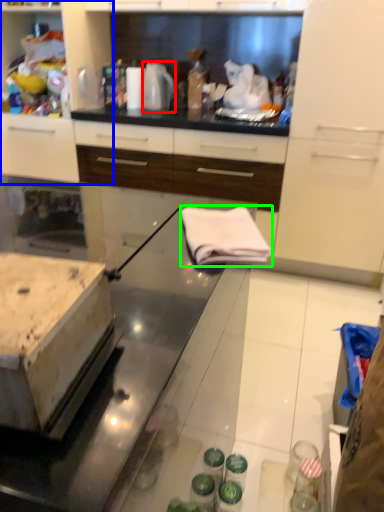
Question: Which object is positioned closest to kitchen appliance (highlighted by a red box)? Select from cabinetry (highlighted by a blue box) and cloth (highlighted by a green box).

Choices:
 (A) cabinetry
 (B) cloth

Answer: (A)